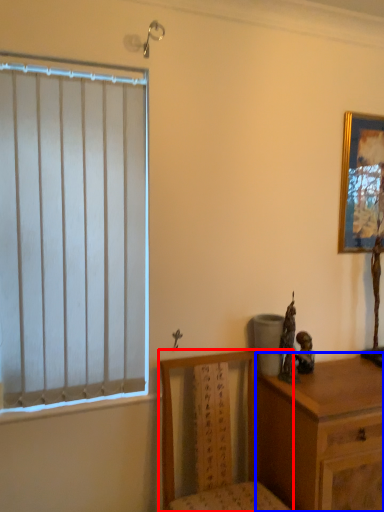
Question: Among these objects, which one is nearest to the camera, chair (highlighted by a red box) or chest of drawers (highlighted by a blue box)?

Choices:
 (A) chair
 (B) chest of drawers

Answer: (A)